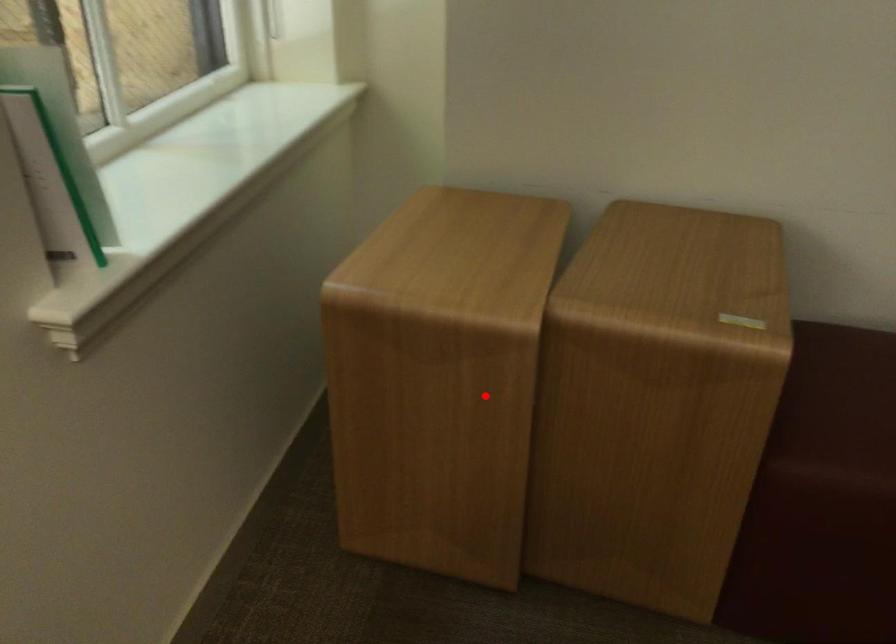
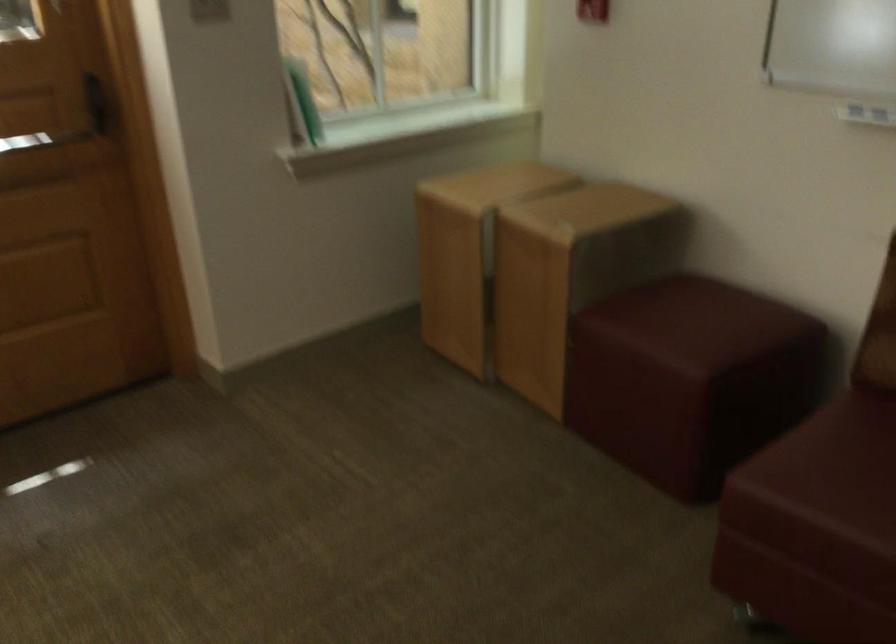
In the second image, find the point that corresponds to the highlighted location in the first image.

(469, 252)